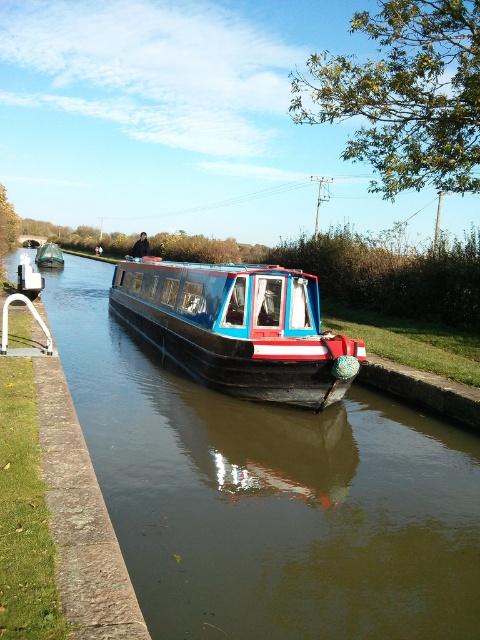
Question: Can you confirm if brown wooden boat at center is thinner than matte black boat at center?

Choices:
 (A) no
 (B) yes

Answer: (A)

Question: Does brown wooden boat at center appear over matte blue and red boat at center?

Choices:
 (A) no
 (B) yes

Answer: (A)

Question: Which point appears farthest from the camera in this image?

Choices:
 (A) (44, 257)
 (B) (311, 292)
 (C) (210, 486)

Answer: (A)

Question: Which object appears closest to the camera in this image?

Choices:
 (A) brown wooden boat at center
 (B) matte black boat at center

Answer: (A)

Question: Which object appears closest to the camera in this image?

Choices:
 (A) matte blue and red boat at center
 (B) brown wooden boat at center
 (C) matte black boat at center

Answer: (B)

Question: Is brown wooden boat at center above matte blue and red boat at center?

Choices:
 (A) yes
 (B) no

Answer: (B)